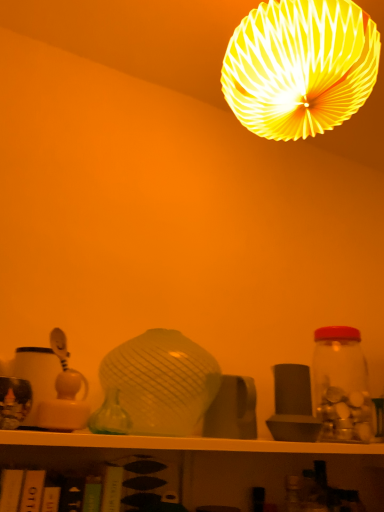
Question: Is green glass vase at center in front of or behind transparent glass jar at right in the image?

Choices:
 (A) front
 (B) behind

Answer: (A)

Question: Is point (117, 401) closer or farther from the camera than point (342, 433)?

Choices:
 (A) closer
 (B) farther

Answer: (A)

Question: Estimate the real-world distances between objects in this image. Which object is farther from the yellow paper lampshade at upper center?

Choices:
 (A) transparent glass jar at right
 (B) green glass vase at center
 (C) matte yellow plastic toy at left

Answer: (B)

Question: Based on their relative distances, which object is nearer to the yellow paper lampshade at upper center?

Choices:
 (A) green glass vase at center
 (B) matte yellow plastic toy at left
 (C) transparent glass jar at right

Answer: (C)